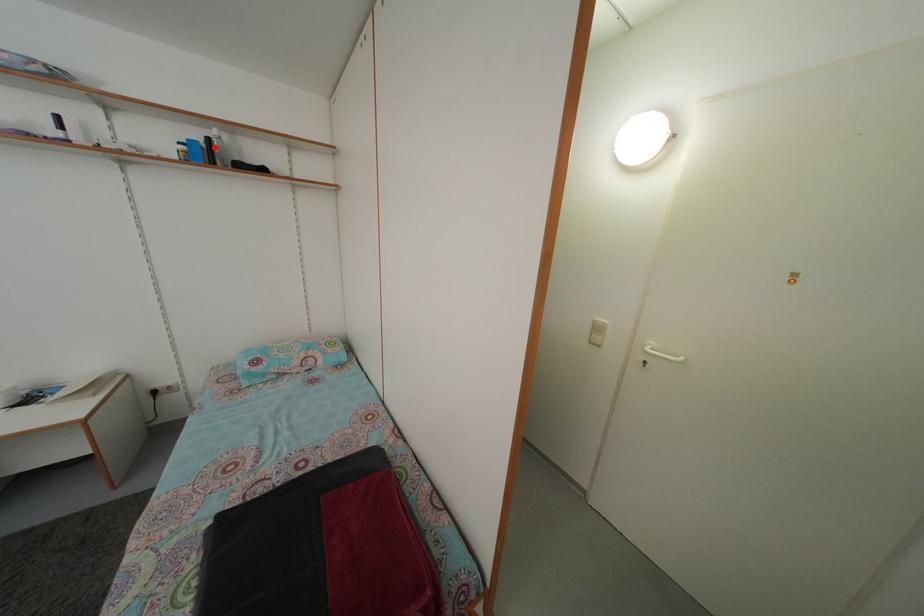
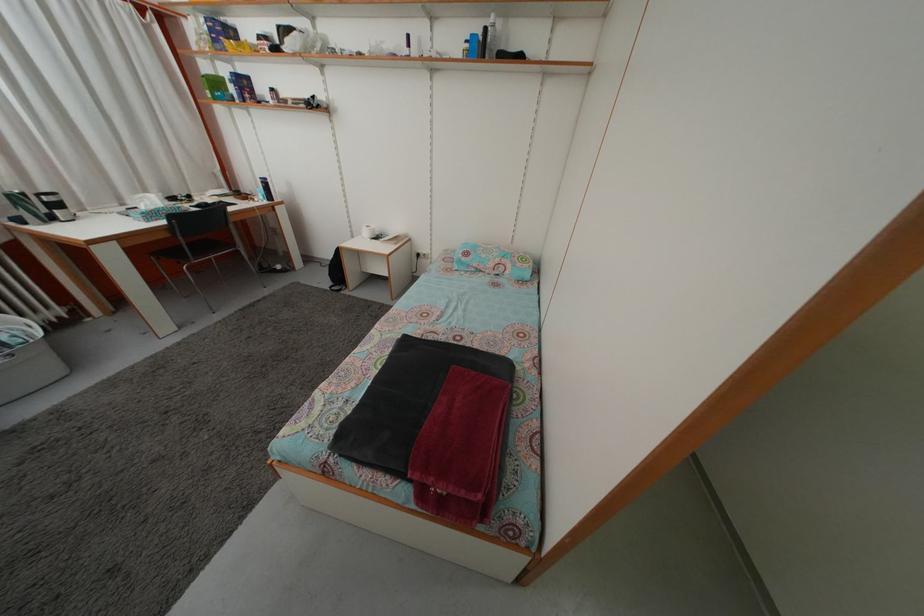
Where in the second image is the point corresponding to the highlighted location from the first image?

(492, 38)